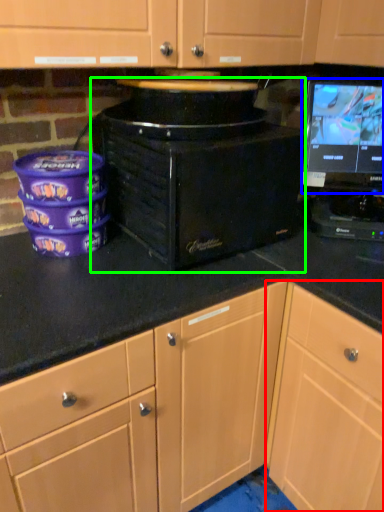
Question: Considering the real-world distances, which object is closest to cabinetry (highlighted by a red box)? computer monitor (highlighted by a blue box) or home appliance (highlighted by a green box).

Choices:
 (A) computer monitor
 (B) home appliance

Answer: (B)